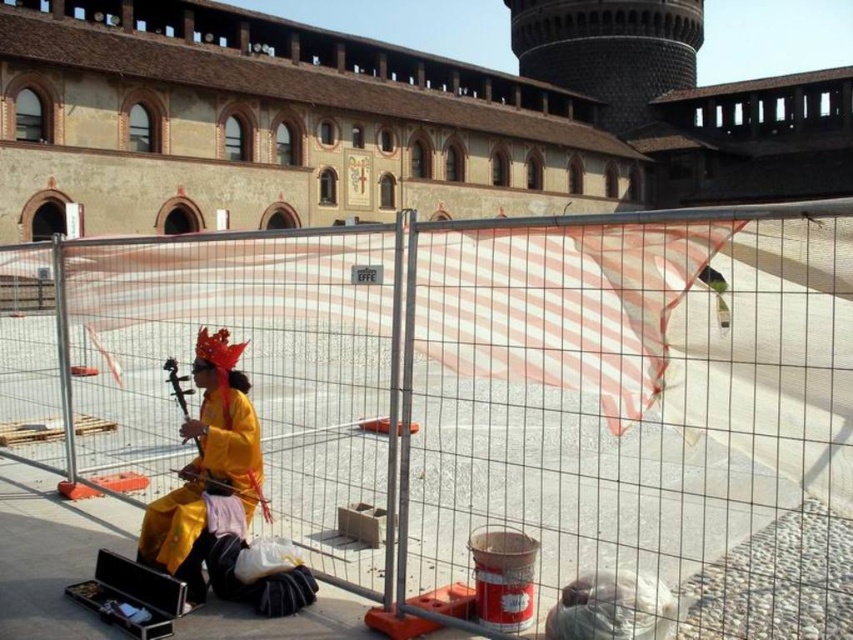
Is point (428, 604) positioned behind point (189, 465)?

That is False.

Does metal fence at center have a lesser width compared to yellow silk robe at center?

In fact, metal fence at center might be wider than yellow silk robe at center.

You are a GUI agent. You are given a task and a screenshot of the screen. Output one action in this format:
    pyautogui.click(x=<x>, y=<y>)
    Task: Click on the metal fence at center
    
    Given the screenshot: What is the action you would take?
    pos(485,400)

Locate an element on the screen. metal fence at center is located at coordinates (485, 400).